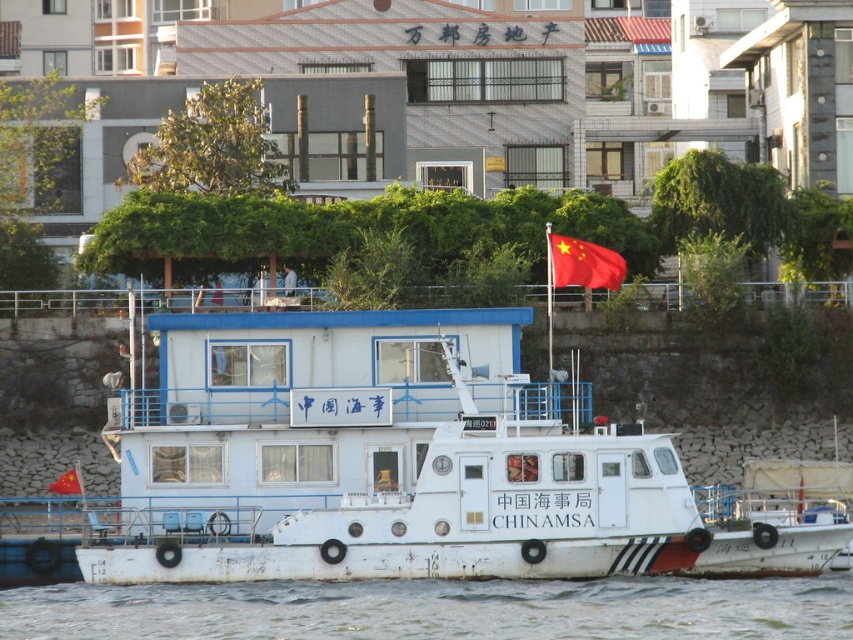
Measure the distance between white matte water at lower center and red fabric flag at upper center.

They are 10.74 meters apart.

Identify the location of white matte water at lower center. (439, 609).

At what (x,y) coordinates should I click in order to perform the action: click on white matte water at lower center. Please return your answer as a coordinate pair (x, y). Looking at the image, I should click on click(x=439, y=609).

Locate an element on the screen. white matte water at lower center is located at coordinates (439, 609).

Which is below, white matte boat at center or red fabric flag at upper center?

Positioned lower is white matte boat at center.

Locate an element on the screen. white matte boat at center is located at coordinates (442, 509).

Does red fabric flag at upper center have a lesser width compared to red fabric flag at center?

Indeed, red fabric flag at upper center has a lesser width compared to red fabric flag at center.

Is red fabric flag at upper center to the left of red fabric flag at center from the viewer's perspective?

In fact, red fabric flag at upper center is to the right of red fabric flag at center.

Where is `red fabric flag at upper center`? This screenshot has height=640, width=853. red fabric flag at upper center is located at coordinates (584, 262).

The width and height of the screenshot is (853, 640). In order to click on red fabric flag at upper center in this screenshot , I will do pyautogui.click(x=584, y=262).